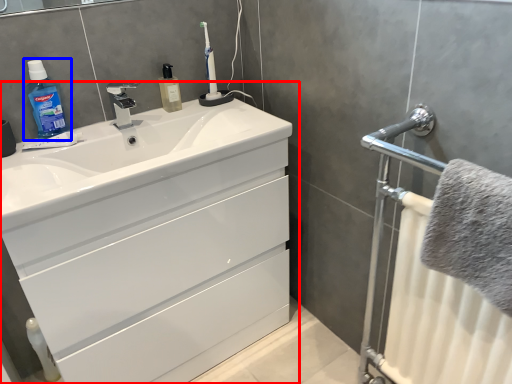
Question: Which point is further to the camera, bathroom cabinet (highlighted by a red box) or cleaning product (highlighted by a blue box)?

Choices:
 (A) bathroom cabinet
 (B) cleaning product

Answer: (B)